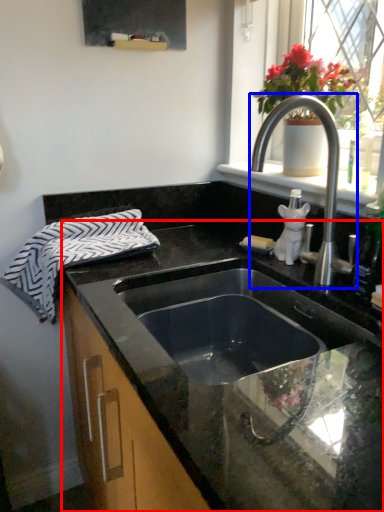
Question: Which of the following is the farthest to the observer, countertop (highlighted by a red box) or tap (highlighted by a blue box)?

Choices:
 (A) countertop
 (B) tap

Answer: (B)